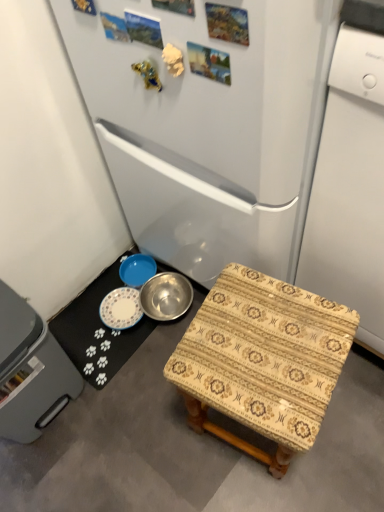
Locate an element on the screen. vacant space in front of metallic silver bowl at lower center is located at coordinates (119, 419).